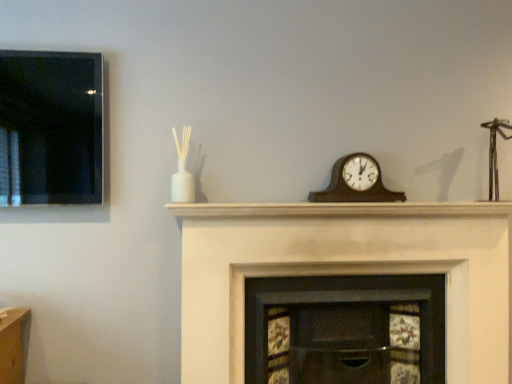
Question: Is wooden clock at center completely or partially outside of white matte mantle at center?

Choices:
 (A) no
 (B) yes

Answer: (B)

Question: Is wooden clock at center beside white matte mantle at center?

Choices:
 (A) yes
 (B) no

Answer: (B)

Question: Does wooden clock at center have a smaller size compared to white matte mantle at center?

Choices:
 (A) no
 (B) yes

Answer: (B)

Question: Considering the relative positions of wooden clock at center and white matte mantle at center in the image provided, is wooden clock at center to the right of white matte mantle at center from the viewer's perspective?

Choices:
 (A) yes
 (B) no

Answer: (A)

Question: Would you consider wooden clock at center to be distant from white matte mantle at center?

Choices:
 (A) no
 (B) yes

Answer: (A)

Question: Considering their positions, is white painted wood fireplace at center, the 2th fireplace from the left, located in front of or behind white matte mantle at center?

Choices:
 (A) behind
 (B) front

Answer: (B)

Question: From a real-world perspective, is white painted wood fireplace at center, the 2th fireplace from the left, physically located above or below white matte mantle at center?

Choices:
 (A) below
 (B) above

Answer: (A)

Question: In terms of size, does white painted wood fireplace at center, positioned as the 1th fireplace in right-to-left order, appear bigger or smaller than white matte mantle at center?

Choices:
 (A) big
 (B) small

Answer: (A)

Question: Considering the relative positions of white painted wood fireplace at center, positioned as the 1th fireplace in right-to-left order, and white matte mantle at center in the image provided, is white painted wood fireplace at center, positioned as the 1th fireplace in right-to-left order, to the left or to the right of white matte mantle at center?

Choices:
 (A) left
 (B) right

Answer: (A)

Question: Is white matte mantle at center to the left or to the right of wooden fireplace at center, which appears as the second fireplace when viewed from the right, in the image?

Choices:
 (A) right
 (B) left

Answer: (A)

Question: In the image, is white matte mantle at center positioned in front of or behind wooden fireplace at center, positioned as the first fireplace in left-to-right order?

Choices:
 (A) front
 (B) behind

Answer: (A)

Question: In terms of height, does white matte mantle at center look taller or shorter compared to wooden fireplace at center, positioned as the first fireplace in left-to-right order?

Choices:
 (A) tall
 (B) short

Answer: (B)

Question: Is point (392, 203) positioned closer to the camera than point (400, 334)?

Choices:
 (A) farther
 (B) closer

Answer: (B)

Question: Considering the relative positions of wooden clock at center and white painted wood fireplace at center, positioned as the 1th fireplace in right-to-left order, in the image provided, is wooden clock at center to the left or to the right of white painted wood fireplace at center, positioned as the 1th fireplace in right-to-left order,?

Choices:
 (A) right
 (B) left

Answer: (A)

Question: Is wooden clock at center inside or outside of white painted wood fireplace at center, positioned as the 1th fireplace in right-to-left order?

Choices:
 (A) inside
 (B) outside

Answer: (B)